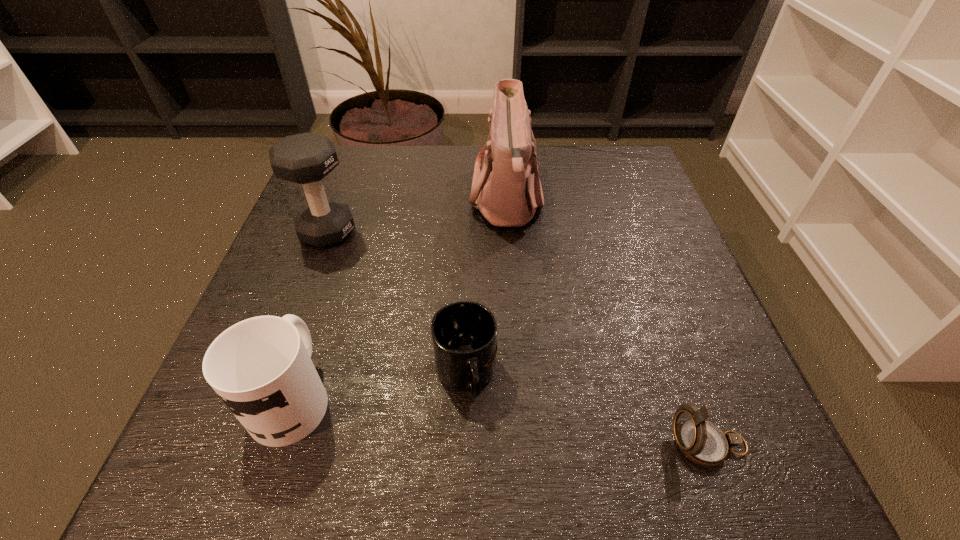
Locate an element on the screen. shoulder bag is located at coordinates (507, 190).

Find the location of a particular element. The width and height of the screenshot is (960, 540). dumbbell is located at coordinates [x=306, y=158].

In order to click on the taller mug in this screenshot , I will do `click(261, 367)`.

At what (x,y) coordinates should I click in order to perform the action: click on the left mug. Please return your answer as a coordinate pair (x, y). The height and width of the screenshot is (540, 960). Looking at the image, I should click on (261, 367).

Locate an element on the screen. the shorter mug is located at coordinates (464, 334).

This screenshot has width=960, height=540. Identify the location of compass. (702, 442).

Find the location of a particular element. vacant space located 0.070m on the front pocket of the shoulder bag is located at coordinates (439, 200).

The image size is (960, 540). I want to click on free space located on the front pocket of the shoulder bag, so click(x=373, y=200).

Image resolution: width=960 pixels, height=540 pixels. I want to click on vacant region located 0.070m on the front pocket of the shoulder bag, so click(x=439, y=200).

Locate an element on the screen. This screenshot has width=960, height=540. free space located 0.070m on the back of the dumbbell is located at coordinates (341, 195).